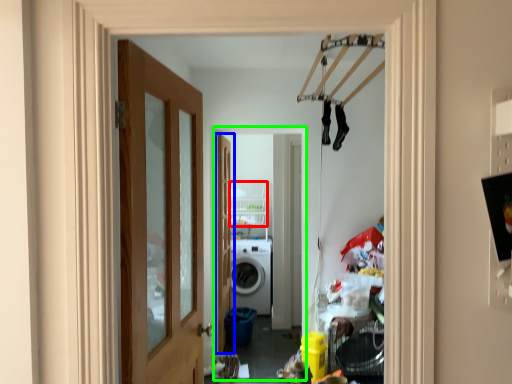
Question: Which object is positioned closest to shelf (highlighted by a red box)? Select from door (highlighted by a blue box) and corridor (highlighted by a green box).

Choices:
 (A) door
 (B) corridor

Answer: (B)